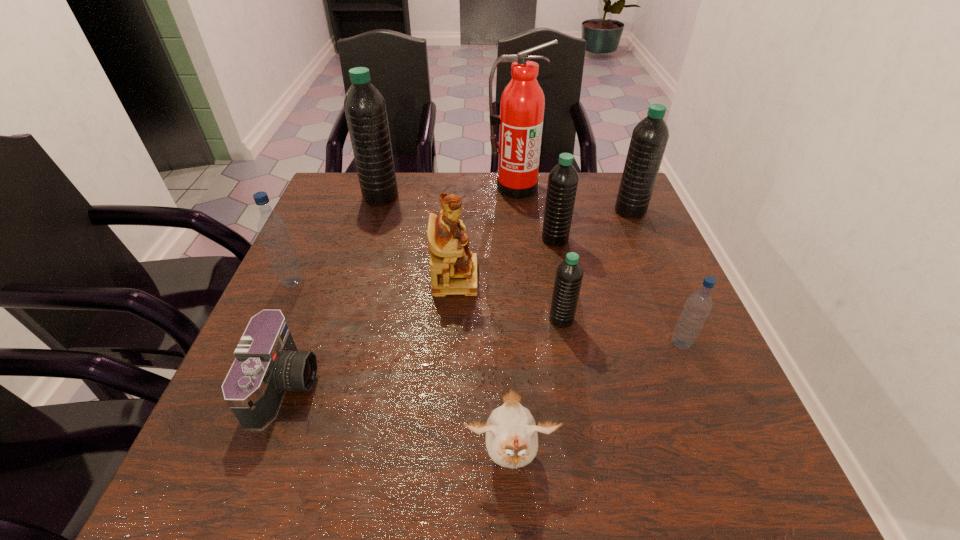
Identify the location of free spot that satisfies the following two spatial constraints: 1. on the label side of the fire extinguisher; 2. on the right side of the nearer blue water bottle. This screenshot has width=960, height=540. (532, 343).